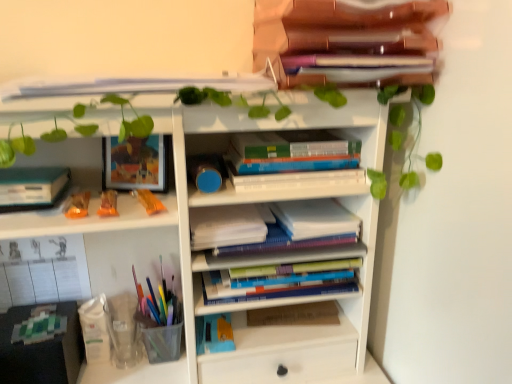
Question: Is wooden folder at upper center, arranged as the 4th book when ordered from the bottom, to the left or to the right of white matte bookshelf at center in the image?

Choices:
 (A) left
 (B) right

Answer: (B)

Question: Based on their sizes in the image, would you say wooden folder at upper center, the 1th book when ordered from top to bottom, is bigger or smaller than white matte bookshelf at center?

Choices:
 (A) small
 (B) big

Answer: (A)

Question: Estimate the real-world distances between objects in this image. Which object is farther from the translucent orange toy at left, acting as the 2th toy starting from the right?

Choices:
 (A) white paper at center, which is the 1th paperback book from right to left
 (B) translucent plastic pen holder at lower left
 (C) hardcover book at left, which is the fourth paperback book in right-to-left order
 (D) hardcover book at center, positioned as the fourth paperback book in top-to-bottom order
 (E) hardcover books at center, the 2th book when ordered from bottom to top

Answer: (D)

Question: Which object is the farthest from the hardcover books at center, positioned as the fourth book in top-to-bottom order?

Choices:
 (A) translucent orange candy at left, marked as the 3th toy in a left-to-right arrangement
 (B) hardcover book at center, acting as the 3th paperback book starting from the left
 (C) white matte bookshelf at center
 (D) white paper at center, which is the 1th paperback book from right to left
 (E) translucent plastic pen holder at lower left

Answer: (A)